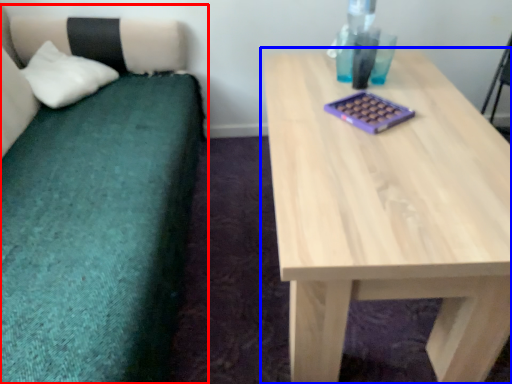
Question: Which object is further to the camera taking this photo, studio couch (highlighted by a red box) or table (highlighted by a blue box)?

Choices:
 (A) studio couch
 (B) table

Answer: (B)